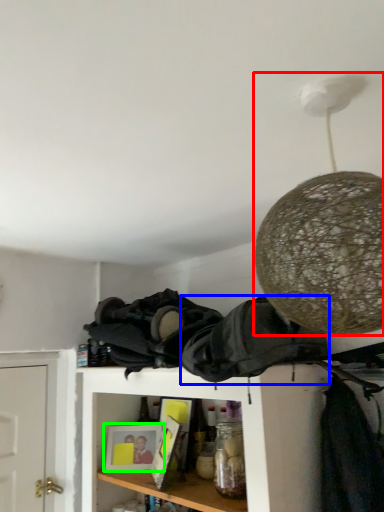
Question: Based on their relative distances, which object is farther from lamp (highlighted by a red box)? Choose from clothing (highlighted by a blue box) and picture frame (highlighted by a green box).

Choices:
 (A) clothing
 (B) picture frame

Answer: (B)